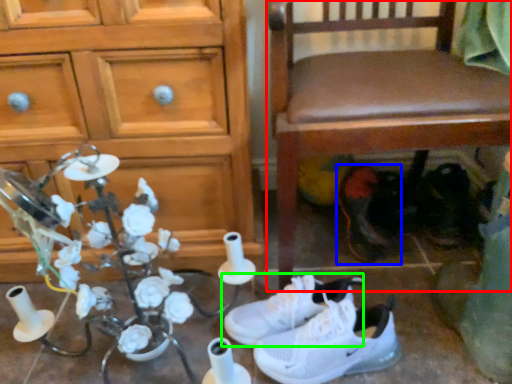
Question: Which is farther away from chair (highlighted by a red box)? footwear (highlighted by a blue box) or footwear (highlighted by a green box)?

Choices:
 (A) footwear
 (B) footwear

Answer: (B)